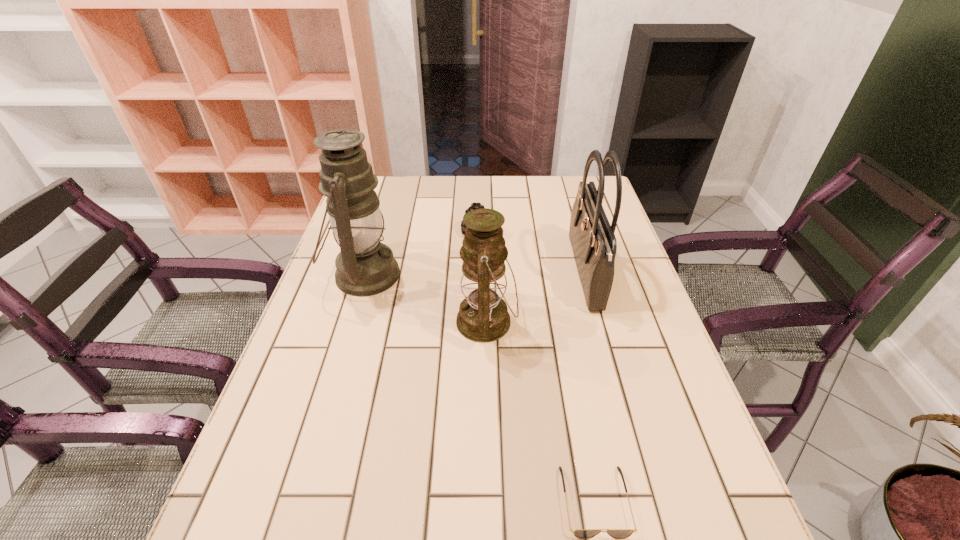
Identify the location of vacant space located with an open clasp on the front of the rightmost object. The width and height of the screenshot is (960, 540). (485, 274).

The width and height of the screenshot is (960, 540). I want to click on vacant space located on the right of the shorter oil lamp, so click(630, 322).

Find the location of a particular element. vacant space located at the narrow end of the second shortest object is located at coordinates (476, 296).

Find the location of a particular element. The image size is (960, 540). object positioned at the near edge is located at coordinates (580, 533).

You are a GUI agent. You are given a task and a screenshot of the screen. Output one action in this format:
    pyautogui.click(x=<x>, y=<y>)
    Task: Click on the object positioned at the left edge
    Image resolution: width=960 pixels, height=540 pixels.
    Given the screenshot: What is the action you would take?
    pyautogui.click(x=365, y=267)

Locate an element on the screen. The image size is (960, 540). object located in the right edge section of the desktop is located at coordinates (594, 245).

Locate an element on the screen. The height and width of the screenshot is (540, 960). vacant area at the far edge is located at coordinates (492, 192).

In the image, there is a desktop. Where is `free region at the left edge`? The width and height of the screenshot is (960, 540). free region at the left edge is located at coordinates (330, 354).

Find the location of `free region at the right edge`. free region at the right edge is located at coordinates (630, 429).

You are a GUI agent. You are given a task and a screenshot of the screen. Output one action in this format:
    pyautogui.click(x=<x>, y=<y>)
    Task: Click on the vacant region between the left oil lamp and the pinecone
    Image resolution: width=960 pixels, height=540 pixels.
    Given the screenshot: What is the action you would take?
    pyautogui.click(x=420, y=254)